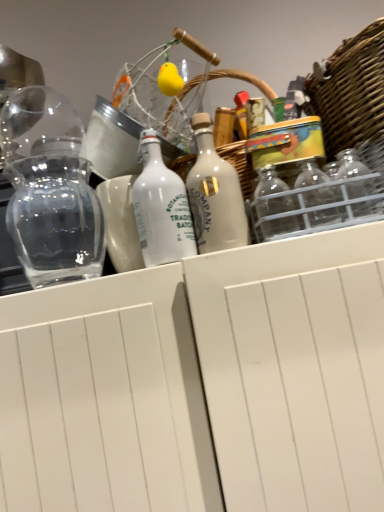
Question: Is woven wicker basket at upper right inside the boundaries of white matte bottle at center, which is the 1th bottle in left-to-right order, or outside?

Choices:
 (A) outside
 (B) inside

Answer: (A)

Question: Is woven wicker basket at upper right in front of or behind white matte bottle at center, positioned as the 2th bottle in right-to-left order, in the image?

Choices:
 (A) behind
 (B) front

Answer: (B)

Question: Based on their relative distances, which object is nearer to the woven wicker basket at upper right?

Choices:
 (A) white matte bottle at center, which is the 1th bottle in left-to-right order
 (B) white matte bottle at center, the first bottle viewed from the right
 (C) transparent glass vase at left

Answer: (B)

Question: Which object is the farthest from the white matte bottle at center, placed as the 2th bottle when sorted from left to right?

Choices:
 (A) woven wicker basket at upper right
 (B) transparent glass vase at left
 (C) white matte bottle at center, which is the 1th bottle in left-to-right order

Answer: (B)